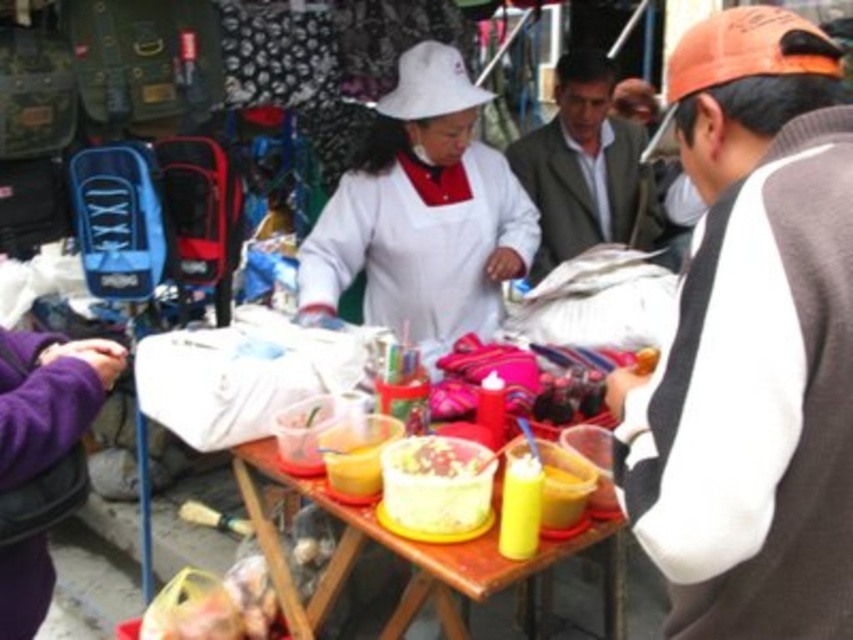
Question: Does orange fabric street vendor at right lie in front of yellow plastic bag at lower left?

Choices:
 (A) yes
 (B) no

Answer: (A)

Question: Based on their relative distances, which object is farther from the white matte apron at center?

Choices:
 (A) orange fabric street vendor at right
 (B) gray woolen sweater at upper center

Answer: (A)

Question: Where is gray woolen sweater at upper center located in relation to yellow plastic bag at lower left in the image?

Choices:
 (A) above
 (B) below

Answer: (A)

Question: Estimate the real-world distances between objects in this image. Which object is closer to the orange fabric street vendor at right?

Choices:
 (A) gray woolen sweater at upper center
 (B) shiny plastic bowl at center
 (C) wooden table at center

Answer: (B)

Question: Is orange fabric street vendor at right further to the viewer compared to white matte apron at center?

Choices:
 (A) yes
 (B) no

Answer: (B)

Question: Estimate the real-world distances between objects in this image. Which object is closer to the white matte apron at center?

Choices:
 (A) yellow plastic bag at lower left
 (B) shiny plastic bowl at center

Answer: (A)